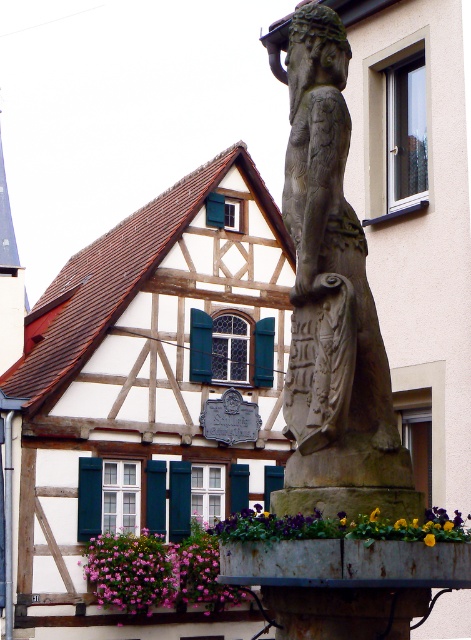
You are a visitor standing in front of the traditional half timbered house and looking at the stone statue at center and the purple fabric flower at center. Which object is closer to you?

The stone statue at center is closer to you than the purple fabric flower at center.

In the scene shown: You are a gardener who wants to water the pink fabric flowers at lower left. The green painted wood shutter at center is blocking the path. Can you move the flowers to the right side to avoid the shutter?

The pink fabric flowers at lower left is positioned under the green painted wood shutter at center, so moving them to the right might still be blocked by the shutter. Consider moving them behind or around the shutter instead.